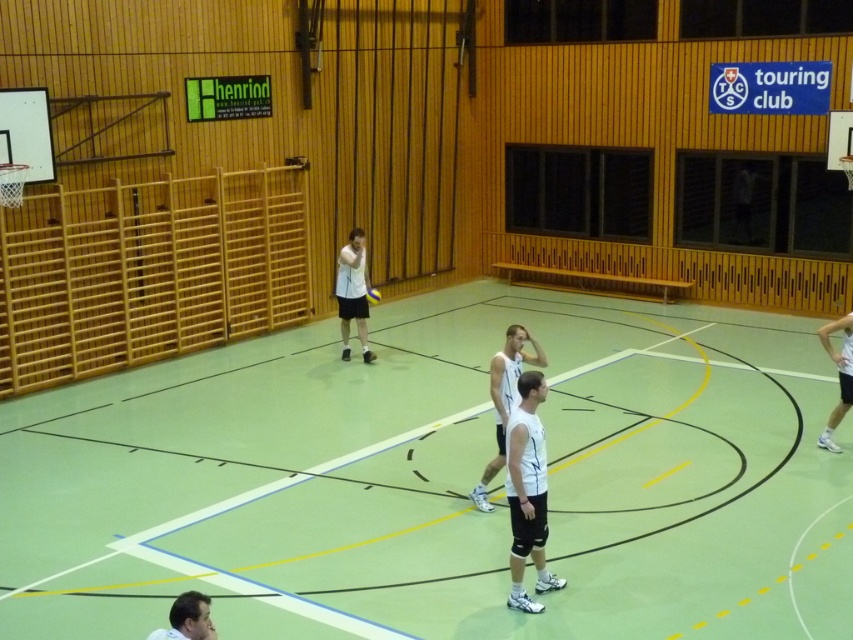
Describe the element at coordinates (527, 492) in the screenshot. This screenshot has width=853, height=640. I see `white matte/vinyl shorts at center` at that location.

Does white matte/vinyl shorts at center have a lesser width compared to smooth white shirt at lower center?

No.

Between point (512, 572) and point (198, 604), which one is positioned behind?

Positioned behind is point (512, 572).

Identify the location of white matte/vinyl shorts at center. This screenshot has width=853, height=640. (527, 492).